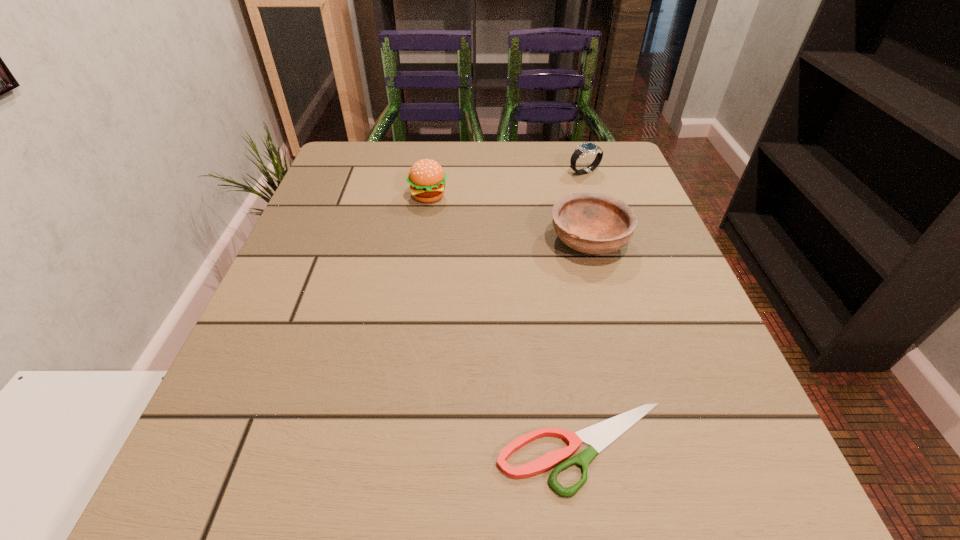
At what (x,y) coordinates should I click in order to perform the action: click on the leftmost object. Please return your answer as a coordinate pair (x, y). This screenshot has height=540, width=960. Looking at the image, I should click on click(x=426, y=177).

This screenshot has width=960, height=540. In order to click on the second farthest object in this screenshot , I will do `click(426, 177)`.

Find the location of `the farthest object`. the farthest object is located at coordinates (584, 149).

Where is `bowl`? The width and height of the screenshot is (960, 540). bowl is located at coordinates (589, 222).

The height and width of the screenshot is (540, 960). Find the location of `the nearest object`. the nearest object is located at coordinates (598, 436).

The image size is (960, 540). I want to click on scissors, so click(x=598, y=436).

Identify the location of vacant region located on the right of the third nearest object. The width and height of the screenshot is (960, 540). (624, 197).

Where is `vacant position located on the front of the watch`? vacant position located on the front of the watch is located at coordinates (618, 275).

Find the location of a particular element. free region located on the back of the third farthest object is located at coordinates (563, 145).

What are the coordinates of `free space located on the left of the shortest object` in the screenshot? It's located at (208, 448).